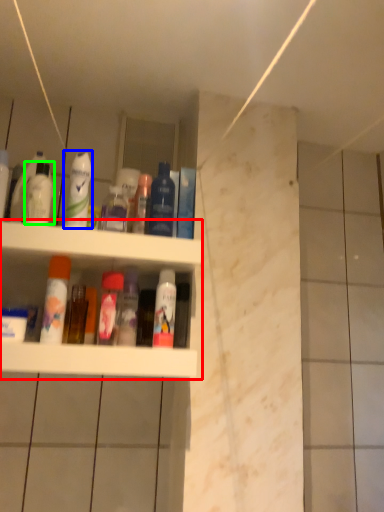
Question: Which is nearer to the shelf (highlighted by a red box)? cleaning product (highlighted by a blue box) or mouthwash (highlighted by a green box).

Choices:
 (A) cleaning product
 (B) mouthwash

Answer: (A)